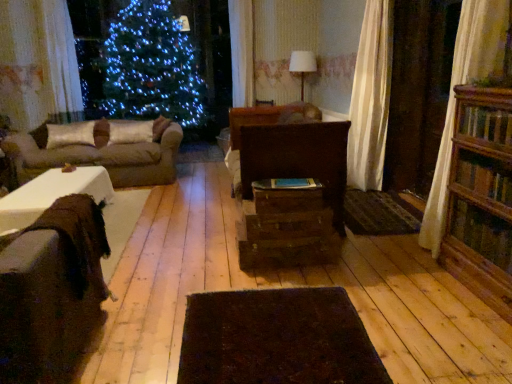
Measure the distance between point (x=292, y=211) and camera.

Point (x=292, y=211) is 9.35 feet away from camera.

This screenshot has width=512, height=384. Describe the element at coordinates (481, 197) in the screenshot. I see `wooden bookcase at right` at that location.

Locate an element on the screen. Image resolution: width=512 pixels, height=384 pixels. wooden bookcase at right is located at coordinates (481, 197).

The image size is (512, 384). In order to click on silky beige pillow at center, arranged as the second pillow when viewed from the left in this screenshot , I will do `click(130, 131)`.

The image size is (512, 384). Describe the element at coordinates (52, 294) in the screenshot. I see `brown fuzzy studio couch at left, the 2th studio couch in the top-to-bottom sequence` at that location.

Where is `dark brown rug at center`? The height and width of the screenshot is (384, 512). dark brown rug at center is located at coordinates (277, 339).

Is white sheer curtain at upper left oriented towards silky gold pillow at left, which ranks as the 1th pillow in left-to-right order?

No, white sheer curtain at upper left is not turned towards silky gold pillow at left, which ranks as the 1th pillow in left-to-right order.

Which of these two, white sheer curtain at upper left or silky gold pillow at left, acting as the 2th pillow starting from the right, is thinner?

white sheer curtain at upper left is thinner.

Is silky gold pillow at left, acting as the 2th pillow starting from the right, completely or partially inside white sheer curtain at upper left?

Definitely not — silky gold pillow at left, acting as the 2th pillow starting from the right, is not inside white sheer curtain at upper left.

What are the coordinates of `curtain above the silky gold pillow at left, which ranks as the 1th pillow in left-to-right order (from a real-world perspective)` in the screenshot? It's located at (61, 58).

Which is correct: wooden drawer at center, placed as the 2th drawer when sorted from top to bottom, is inside white sheer curtain at upper left, or outside of it?

wooden drawer at center, placed as the 2th drawer when sorted from top to bottom, exists outside the volume of white sheer curtain at upper left.

In the scene shown: From the image's perspective, would you say wooden drawer at center, which ranks as the 1th drawer in bottom-to-top order, is shown under white sheer curtain at upper left?

Correct, wooden drawer at center, which ranks as the 1th drawer in bottom-to-top order, appears lower than white sheer curtain at upper left in the image.

Does point (329, 228) come behind point (71, 106)?

No, (329, 228) is closer to viewer.

Which of these two, white sheer curtain at upper left or dark brown textured mat at center, is smaller?

dark brown textured mat at center is smaller.

Is white sheer curtain at upper left not close to dark brown textured mat at center?

Yes, white sheer curtain at upper left and dark brown textured mat at center are quite far apart.

How different are the orientations of white sheer curtain at upper left and dark brown textured mat at center in degrees?

white sheer curtain at upper left and dark brown textured mat at center are facing 130 degrees away from each other.

Considering the sizes of objects white sheer curtain at upper left and dark brown textured mat at center in the image provided, who is thinner, white sheer curtain at upper left or dark brown textured mat at center?

With smaller width is white sheer curtain at upper left.

Considering the relative sizes of brown fuzzy studio couch at left, which ranks as the first studio couch in front-to-back order, and wooden bookcase at right in the image provided, is brown fuzzy studio couch at left, which ranks as the first studio couch in front-to-back order, taller than wooden bookcase at right?

Incorrect, the height of brown fuzzy studio couch at left, which ranks as the first studio couch in front-to-back order, is not larger of that of wooden bookcase at right.

Is point (38, 288) farther from camera compared to point (456, 219)?

No, it is not.

From the picture: From a real-world perspective, relative to wooden bookcase at right, is brown fuzzy studio couch at left, which ranks as the first studio couch in front-to-back order, vertically above or below?

From a real-world perspective, brown fuzzy studio couch at left, which ranks as the first studio couch in front-to-back order, is physically below wooden bookcase at right.

Is brown fuzzy studio couch at left, the 2th studio couch in the top-to-bottom sequence, to the left or to the right of wooden bookcase at right in the image?

brown fuzzy studio couch at left, the 2th studio couch in the top-to-bottom sequence, is positioned on wooden bookcase at right's left side.

Is dark brown rug at center in front of or behind white sheer curtain at upper left in the image?

Clearly, dark brown rug at center is in front of white sheer curtain at upper left.

Considering the sizes of objects dark brown rug at center and white sheer curtain at upper left in the image provided, who is bigger, dark brown rug at center or white sheer curtain at upper left?

white sheer curtain at upper left is bigger.

How many degrees apart are the facing directions of dark brown rug at center and white sheer curtain at upper left?

The angle between the facing direction of dark brown rug at center and the facing direction of white sheer curtain at upper left is 139 degrees.

Is dark brown rug at center aimed at white sheer curtain at upper left?

No, dark brown rug at center is not turned towards white sheer curtain at upper left.

From their relative heights in the image, would you say silky gold pillow at left, acting as the 2th pillow starting from the right, is taller or shorter than dark brown textured mat at center?

silky gold pillow at left, acting as the 2th pillow starting from the right, is taller than dark brown textured mat at center.

Which is correct: silky gold pillow at left, which ranks as the 1th pillow in left-to-right order, is inside dark brown textured mat at center, or outside of it?

silky gold pillow at left, which ranks as the 1th pillow in left-to-right order, is outside dark brown textured mat at center.

Is silky gold pillow at left, which ranks as the 1th pillow in left-to-right order, to the left or to the right of dark brown textured mat at center in the image?

From the image, it's evident that silky gold pillow at left, which ranks as the 1th pillow in left-to-right order, is to the left of dark brown textured mat at center.

Find the location of a particular element. mat that is on the right side of silky gold pillow at left, acting as the 2th pillow starting from the right is located at coordinates (379, 213).

Between white sheer curtain at upper left and dark brown rug at center, which one is positioned behind?

white sheer curtain at upper left is more distant.

Does white sheer curtain at upper left turn towards dark brown rug at center?

No.

Is white sheer curtain at upper left completely or partially outside of dark brown rug at center?

Yes, white sheer curtain at upper left is not within dark brown rug at center.

Based on the photo, considering the relative sizes of white sheer curtain at upper left and dark brown rug at center in the image provided, is white sheer curtain at upper left thinner than dark brown rug at center?

Correct, the width of white sheer curtain at upper left is less than that of dark brown rug at center.

Locate an element on the screen. The height and width of the screenshot is (384, 512). curtain above the silky gold pillow at left, which ranks as the 1th pillow in left-to-right order (from a real-world perspective) is located at coordinates coord(61,58).

Identify the location of curtain that is behind the wooden drawer at center, placed as the 2th drawer when sorted from top to bottom. (61, 58).

Considering their positions, is silky gold pillow at left, acting as the 2th pillow starting from the right, positioned further to brown fuzzy studio couch at left, which ranks as the first studio couch in front-to-back order, than wooden bookcase at right?

silky gold pillow at left, acting as the 2th pillow starting from the right, is further to brown fuzzy studio couch at left, which ranks as the first studio couch in front-to-back order.

Looking at the image, which one is located further to wooden drawer at center, acting as the 1th drawer starting from the top, wooden bookcase at right or white sheer curtain at upper left?

The object further to wooden drawer at center, acting as the 1th drawer starting from the top, is white sheer curtain at upper left.

Consider the image. Considering their positions, is silky beige pillow at center, the first pillow from the right, positioned closer to silky gold pillow at left, which ranks as the 1th pillow in left-to-right order, than wooden drawer at center, acting as the 1th drawer starting from the top?

The object closer to silky gold pillow at left, which ranks as the 1th pillow in left-to-right order, is silky beige pillow at center, the first pillow from the right.

Based on their spatial positions, is silky beige pillow at center, arranged as the second pillow when viewed from the left, or brown fuzzy studio couch at left, the second studio couch viewed from the back, closer to brown fabric couch at left, which appears as the 2th studio couch when viewed from the front?

silky beige pillow at center, arranged as the second pillow when viewed from the left, lies closer to brown fabric couch at left, which appears as the 2th studio couch when viewed from the front, than the other object.

When comparing their distances from wooden bookcase at right, does dark brown rug at center or silky beige pillow at center, arranged as the second pillow when viewed from the left, seem further?

silky beige pillow at center, arranged as the second pillow when viewed from the left, is further to wooden bookcase at right.

When comparing their distances from brown fuzzy studio couch at left, which ranks as the first studio couch in front-to-back order, does wooden drawer at center, which ranks as the 1th drawer in bottom-to-top order, or white sheer curtain at upper left seem further?

white sheer curtain at upper left is further to brown fuzzy studio couch at left, which ranks as the first studio couch in front-to-back order.

Considering their positions, is wooden drawer at center, which ranks as the 1th drawer in bottom-to-top order, positioned further to wooden bookcase at right than white sheer curtain at upper left?

white sheer curtain at upper left.

From the picture: When comparing their distances from wooden drawer at center, placed as the 2th drawer when sorted from top to bottom, does white sheer curtain at upper left or dark brown textured mat at center seem closer?

dark brown textured mat at center is positioned closer to the anchor wooden drawer at center, placed as the 2th drawer when sorted from top to bottom.

Identify the location of drawer between wooden drawer at center, placed as the 2th drawer when sorted from top to bottom, and wooden bookcase at right from left to right. This screenshot has height=384, width=512. (287, 200).

The height and width of the screenshot is (384, 512). Identify the location of wide between brown fuzzy studio couch at left, acting as the 1th studio couch starting from the bottom, and wooden bookcase at right, in the horizontal direction. (277, 339).

Locate an element on the screen. This screenshot has height=384, width=512. bookcase between brown fuzzy studio couch at left, acting as the 1th studio couch starting from the bottom, and white sheer curtain at upper left in the front-back direction is located at coordinates (481, 197).

Locate an element on the screen. Image resolution: width=512 pixels, height=384 pixels. pillow between wooden drawer at center, which ranks as the 1th drawer in bottom-to-top order, and silky beige pillow at center, arranged as the second pillow when viewed from the left, from front to back is located at coordinates (70, 134).